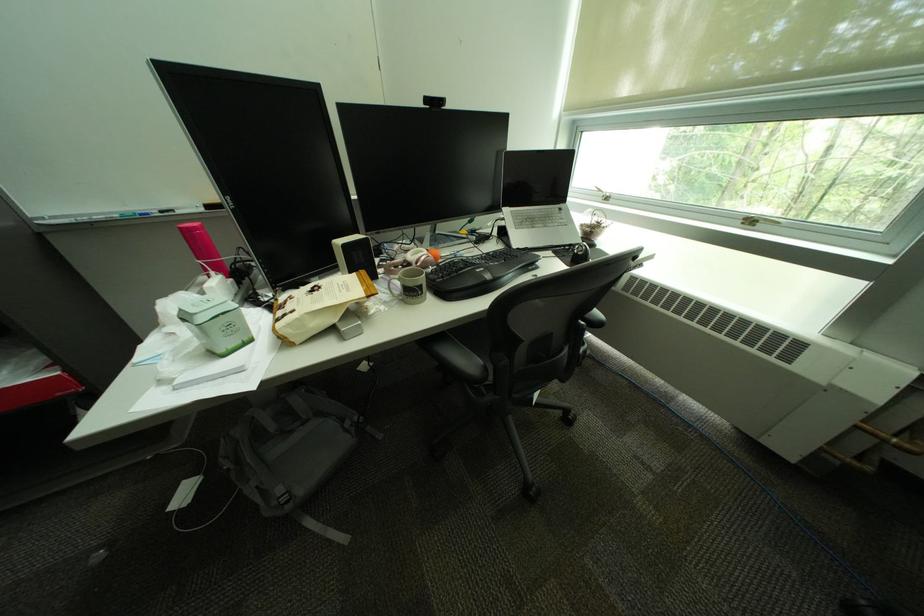
I want to click on chair armrest, so click(598, 318).